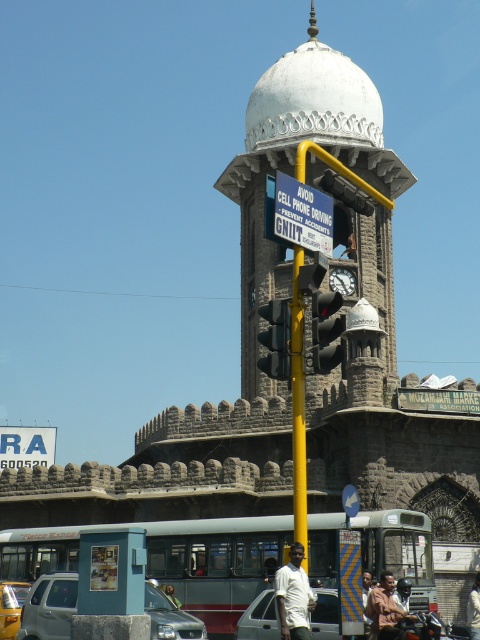
You are a city planner reviewing the layout of this urban area. The city requires that all traffic lights must be placed within a 0.5m radius of the central point to ensure optimal visibility. Given the coordinates provided, is the black glass traffic light at center positioned correctly?

The black glass traffic light at center is located at coordinates point (325,330). Since the city requires traffic lights to be within a 0.5m radius of the central point, we need to calculate the distance from the center. The distance from the center to the traffic light is sqrt 0.517 squared plus 0.679 squared equals approximately 0.85 meters. This exceeds the 0.5m requirement, so the traffic light is not positioned correctly.

You are a city planner analyzing the layout of this urban area. The clock tower is a central landmark. Where is the yellow metallic pole at center located relative to the clock tower?

The yellow metallic pole at center is located at coordinates point (298, 406) relative to the clock tower.

From the picture: You are a pedestrian standing in front of the black glass traffic light at center and the green fabric shirt at center. Which object is bigger?

The black glass traffic light at center is larger than the green fabric shirt at center.